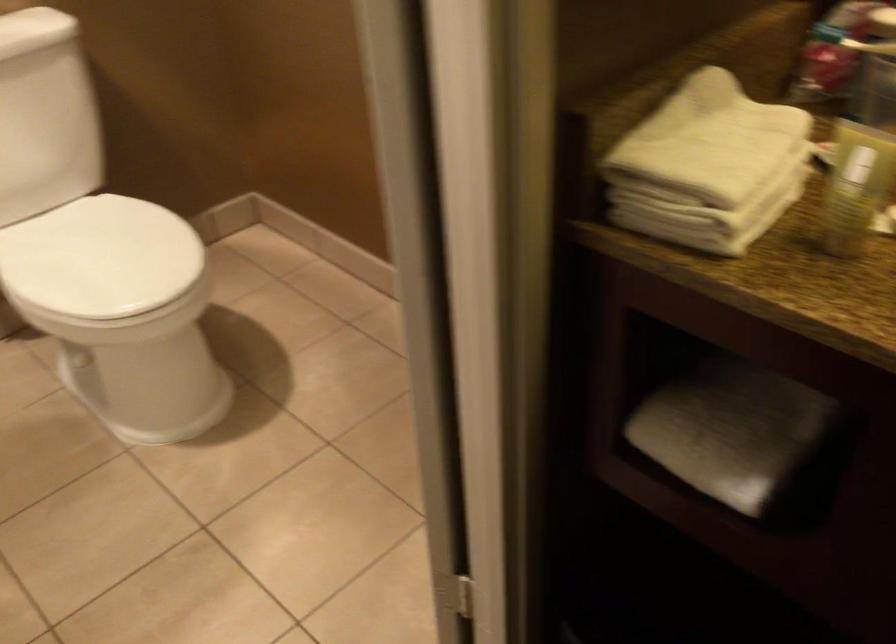
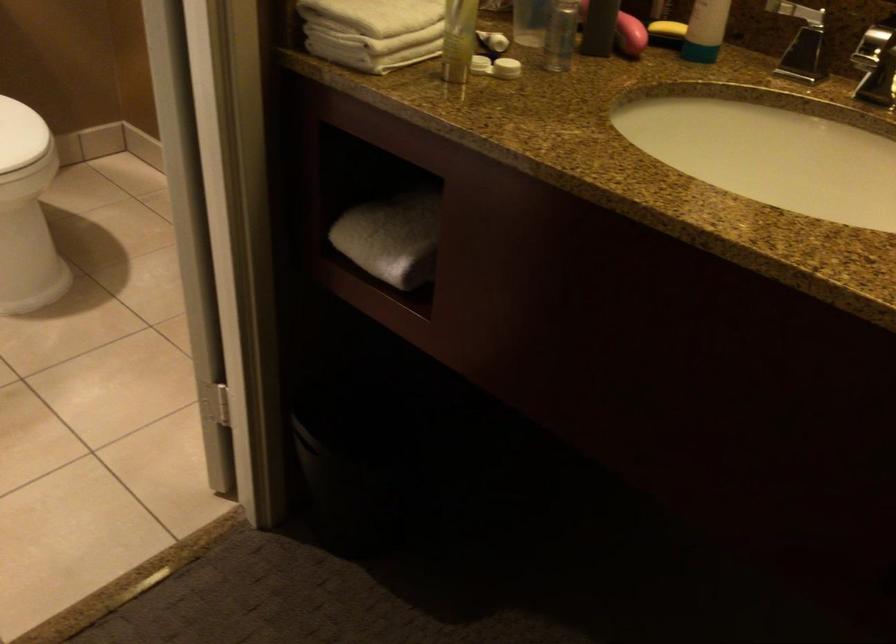
Find the pixel in the second image that matches (728,444) in the first image.

(392, 238)